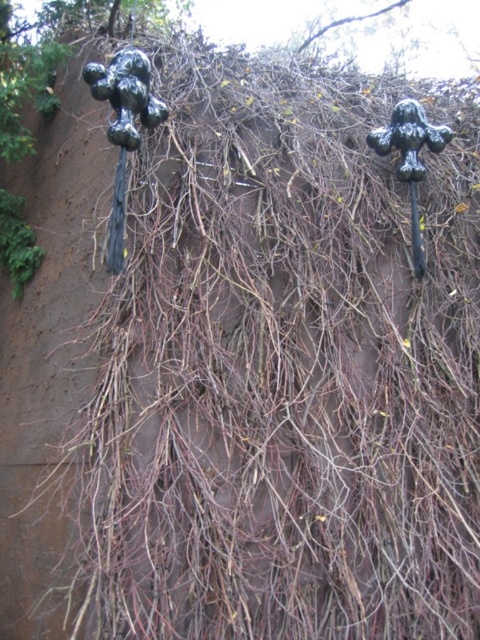
You are an art curator examining the wall with two sculptures. The glossy black sculpture at upper left and the black matte sculpture at right are both on the wall. Which sculpture is closer to the viewer?

The glossy black sculpture at upper left is closer to the viewer than the black matte sculpture at right because it is positioned in front of it.

You are an interior designer planning to place a new artwork between the glossy black sculpture at upper left and the black matte sculpture at right. Considering their sizes, which sculpture should you position closer to the center of the wall to maintain balance?

The glossy black sculpture at upper left occupies less space than the black matte sculpture at right, so you should position the black matte sculpture at right closer to the center to balance their sizes.